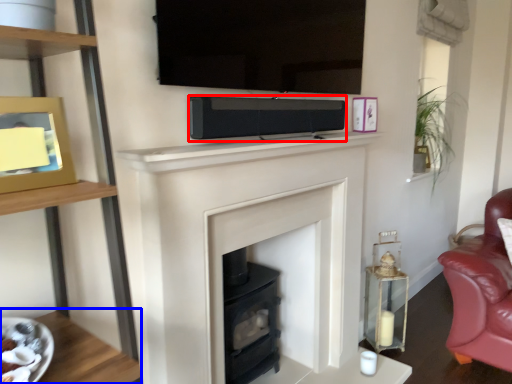
Question: Which of the following is the closest to the observer, stereo (highlighted by a red box) or table (highlighted by a blue box)?

Choices:
 (A) stereo
 (B) table

Answer: (B)